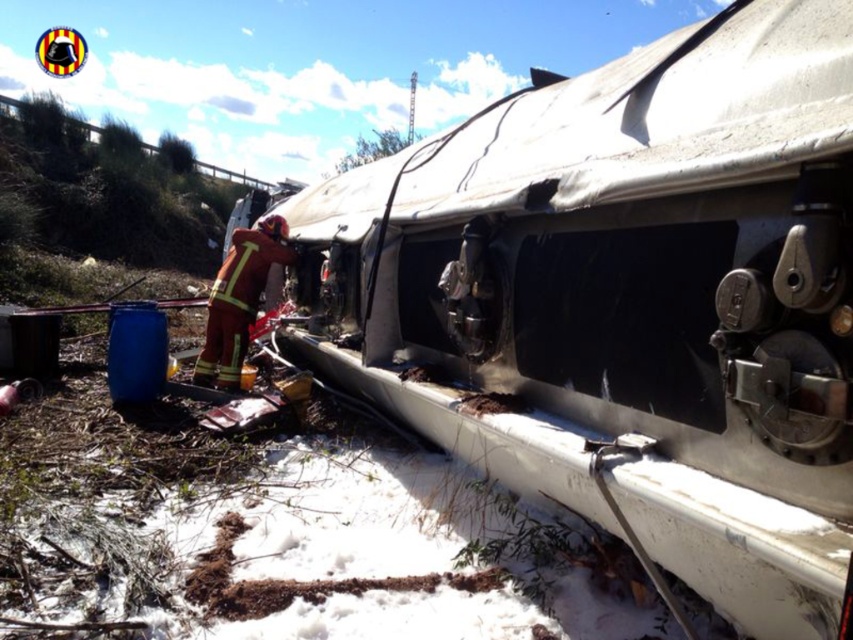
Question: Is silver metallic train car at center below firefighter uniform at center?

Choices:
 (A) yes
 (B) no

Answer: (B)

Question: Does silver metallic train car at center have a greater width compared to firefighter uniform at center?

Choices:
 (A) no
 (B) yes

Answer: (B)

Question: Considering the relative positions of silver metallic train car at center and firefighter uniform at center in the image provided, where is silver metallic train car at center located with respect to firefighter uniform at center?

Choices:
 (A) right
 (B) left

Answer: (A)

Question: Which object is closer to the camera taking this photo?

Choices:
 (A) firefighter uniform at center
 (B) silver metallic train car at center

Answer: (B)